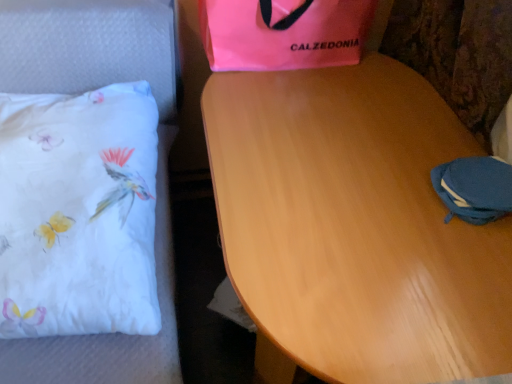
The height and width of the screenshot is (384, 512). What do you see at coordinates (474, 188) in the screenshot?
I see `blue fabric pouch at lower right` at bounding box center [474, 188].

You are a GUI agent. You are given a task and a screenshot of the screen. Output one action in this format:
    pyautogui.click(x=<x>, y=<y>)
    Task: Click on the white fabric pillow at left
    
    Given the screenshot: What is the action you would take?
    pyautogui.click(x=157, y=170)

I want to click on blue fabric pouch at lower right, so click(x=474, y=188).

Considering the positions of objects blue fabric pouch at lower right and white fabric pillow at left in the image provided, who is behind, blue fabric pouch at lower right or white fabric pillow at left?

blue fabric pouch at lower right is further away from the camera.

Is white fabric pillow at left completely or partially inside blue fabric pouch at lower right?

Definitely not — white fabric pillow at left is not inside blue fabric pouch at lower right.

Is point (510, 193) closer to camera compared to point (72, 93)?

Yes.

From the image's perspective, which one is positioned lower, blue fabric pouch at lower right or white fabric pillow at left?

white fabric pillow at left is shown below in the image.

Does light brown wood table at center appear on the left side of pink fabric bag at upper center?

Incorrect, light brown wood table at center is not on the left side of pink fabric bag at upper center.

Can you confirm if light brown wood table at center is smaller than pink fabric bag at upper center?

No.

From the image's perspective, who appears lower, light brown wood table at center or pink fabric bag at upper center?

From the image's view, light brown wood table at center is below.

Looking at this image, can light brown wood table at center be found inside pink fabric bag at upper center?

No, light brown wood table at center is not inside pink fabric bag at upper center.

Looking at this image, is pink fabric bag at upper center to the right of light brown wood table at center from the viewer's perspective?

Incorrect, pink fabric bag at upper center is not on the right side of light brown wood table at center.

Considering the relative sizes of pink fabric bag at upper center and light brown wood table at center in the image provided, is pink fabric bag at upper center wider than light brown wood table at center?

No, pink fabric bag at upper center is not wider than light brown wood table at center.

Considering the sizes of pink fabric bag at upper center and light brown wood table at center in the image, is pink fabric bag at upper center taller or shorter than light brown wood table at center?

In the image, pink fabric bag at upper center appears to be shorter than light brown wood table at center.

Is white fabric pillow at left turned away from blue fabric pouch at lower right?

No, blue fabric pouch at lower right is not at the back of white fabric pillow at left.

The image size is (512, 384). I want to click on pouch on the right of white fabric pillow at left, so click(474, 188).

How different are the orientations of white fabric pillow at left and blue fabric pouch at lower right in degrees?

The angle between the facing direction of white fabric pillow at left and the facing direction of blue fabric pouch at lower right is 88 degrees.

Between blue fabric pouch at lower right and light brown wood table at center, which one is positioned in front?

light brown wood table at center is in front.

Is blue fabric pouch at lower right taller or shorter than light brown wood table at center?

In the image, blue fabric pouch at lower right appears to be shorter than light brown wood table at center.

From a real-world perspective, is blue fabric pouch at lower right under light brown wood table at center?

Incorrect, from a real-world perspective, blue fabric pouch at lower right is higher than light brown wood table at center.

What's the angular difference between blue fabric pouch at lower right and light brown wood table at center's facing directions?

The facing directions of blue fabric pouch at lower right and light brown wood table at center are 0.682 degrees apart.

Is white fabric pillow at left surrounded by pink fabric bag at upper center?

Actually, white fabric pillow at left is outside pink fabric bag at upper center.

From a real-world perspective, is pink fabric bag at upper center above or below white fabric pillow at left?

In terms of real-world spatial position, pink fabric bag at upper center is above white fabric pillow at left.

Is pink fabric bag at upper center closer to the viewer compared to white fabric pillow at left?

That is False.

Is pink fabric bag at upper center far away from white fabric pillow at left?

Actually, pink fabric bag at upper center and white fabric pillow at left are a little close together.

Can you confirm if pink fabric bag at upper center is positioned to the right of blue fabric pouch at lower right?

In fact, pink fabric bag at upper center is to the left of blue fabric pouch at lower right.

Which of these two, pink fabric bag at upper center or blue fabric pouch at lower right, is smaller?

blue fabric pouch at lower right is smaller.

Would you say pink fabric bag at upper center is inside or outside blue fabric pouch at lower right?

pink fabric bag at upper center is not inside blue fabric pouch at lower right, it's outside.

Identify the location of pouch that is above the white fabric pillow at left (from a real-world perspective). This screenshot has width=512, height=384. pos(474,188).

Locate an element on the screen. This screenshot has height=384, width=512. gift bag above the light brown wood table at center (from the image's perspective) is located at coordinates (283, 33).

From the image, which object appears to be nearer to light brown wood table at center, pink fabric bag at upper center or blue fabric pouch at lower right?

Based on the image, blue fabric pouch at lower right appears to be nearer to light brown wood table at center.

Which object lies nearer to the anchor point pink fabric bag at upper center, light brown wood table at center or white fabric pillow at left?

light brown wood table at center is closer to pink fabric bag at upper center.

Considering their positions, is light brown wood table at center positioned further to white fabric pillow at left than pink fabric bag at upper center?

Based on the image, light brown wood table at center appears to be further to white fabric pillow at left.

Estimate the real-world distances between objects in this image. Which object is further from light brown wood table at center, blue fabric pouch at lower right or pink fabric bag at upper center?

pink fabric bag at upper center lies further to light brown wood table at center than the other object.

Based on their spatial positions, is pink fabric bag at upper center or white fabric pillow at left closer to blue fabric pouch at lower right?

pink fabric bag at upper center lies closer to blue fabric pouch at lower right than the other object.

Considering their positions, is light brown wood table at center positioned closer to white fabric pillow at left than blue fabric pouch at lower right?

Based on the image, light brown wood table at center appears to be nearer to white fabric pillow at left.

From the image, which object appears to be nearer to light brown wood table at center, blue fabric pouch at lower right or white fabric pillow at left?

blue fabric pouch at lower right is positioned closer to the anchor light brown wood table at center.

From the image, which object appears to be farther from white fabric pillow at left, blue fabric pouch at lower right or pink fabric bag at upper center?

blue fabric pouch at lower right.

This screenshot has height=384, width=512. I want to click on gift bag located between white fabric pillow at left and blue fabric pouch at lower right in the left-right direction, so tap(283, 33).

Locate an element on the screen. This screenshot has height=384, width=512. pouch between pink fabric bag at upper center and light brown wood table at center in the vertical direction is located at coordinates (474, 188).

I want to click on table between white fabric pillow at left and blue fabric pouch at lower right, so click(x=354, y=227).

Where is `gift bag between white fabric pillow at left and light brown wood table at center from left to right`? gift bag between white fabric pillow at left and light brown wood table at center from left to right is located at coordinates (283, 33).